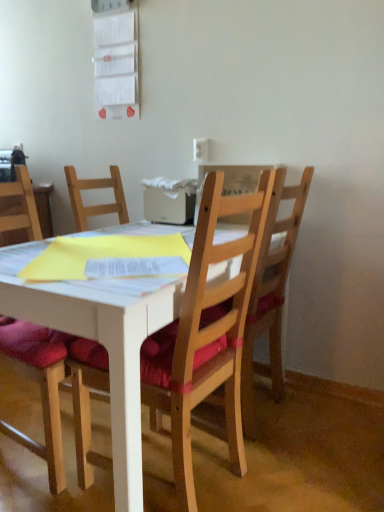
This screenshot has height=512, width=384. Identify the location of free space in front of wooden chair at right, placed as the third chair when sorted from left to right. (283, 461).